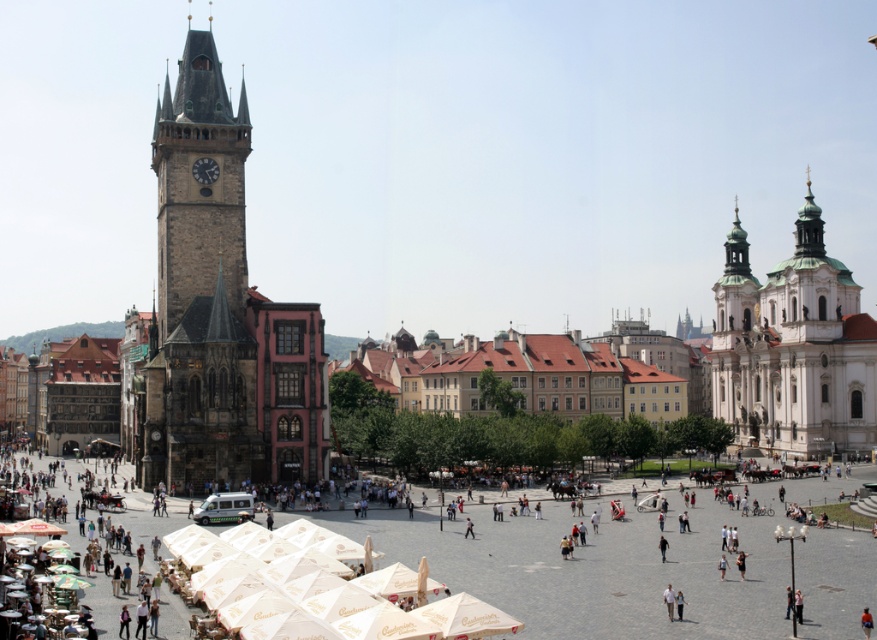
Question: Which of the following is the closest to the observer?

Choices:
 (A) stone clock tower at left
 (B) white stone church at right

Answer: (A)

Question: Can you confirm if stone clock tower at left is smaller than white stone church at right?

Choices:
 (A) yes
 (B) no

Answer: (A)

Question: Can you confirm if stone clock tower at left is positioned to the left of white stone church at right?

Choices:
 (A) yes
 (B) no

Answer: (A)

Question: Is stone clock tower at left further to camera compared to white stone church at right?

Choices:
 (A) no
 (B) yes

Answer: (A)

Question: Which point is farther from the camera taking this photo?

Choices:
 (A) pyautogui.click(x=155, y=340)
 (B) pyautogui.click(x=745, y=257)

Answer: (B)